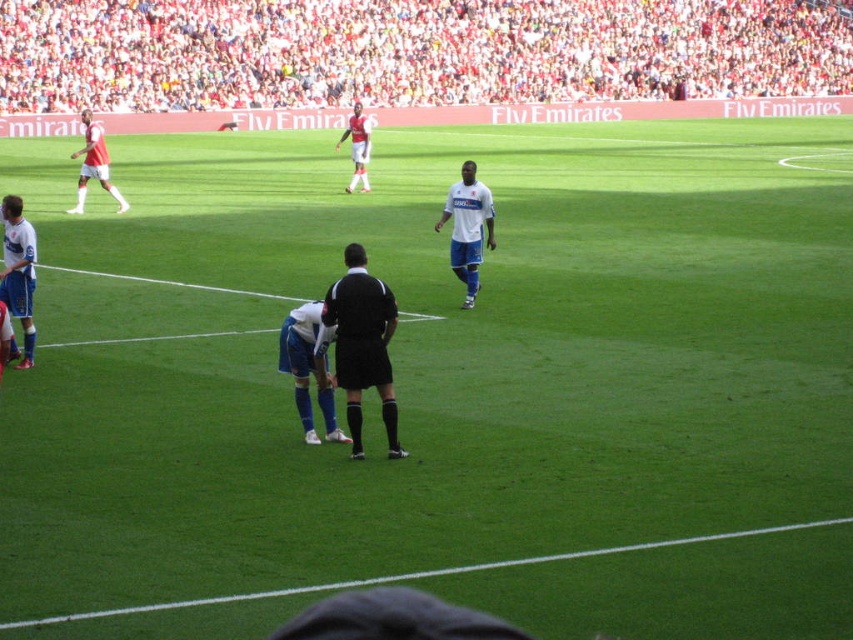
Is white matte soccer player at center to the left of white jersey at left from the viewer's perspective?

In fact, white matte soccer player at center is to the right of white jersey at left.

Does white matte soccer player at center appear over white jersey at left?

Correct, white matte soccer player at center is located above white jersey at left.

This screenshot has width=853, height=640. What do you see at coordinates (468, 227) in the screenshot?
I see `white matte soccer player at center` at bounding box center [468, 227].

Find the location of a particular element. This screenshot has width=853, height=640. white matte soccer player at center is located at coordinates (468, 227).

Is black matte referee at center below matte white shorts at left?

Indeed, black matte referee at center is positioned under matte white shorts at left.

In the scene shown: Between black matte referee at center and matte white shorts at left, which one has more height?

Standing taller between the two is matte white shorts at left.

Who is more forward, (345, 291) or (80, 154)?

Positioned in front is point (345, 291).

This screenshot has height=640, width=853. In order to click on black matte referee at center in this screenshot , I will do `click(363, 344)`.

In the scene shown: Is white fabric crowd at upper center below white matte soccer player at center?

No, white fabric crowd at upper center is not below white matte soccer player at center.

Which is below, white fabric crowd at upper center or white matte soccer player at center?

white matte soccer player at center

The image size is (853, 640). Describe the element at coordinates (412, 51) in the screenshot. I see `white fabric crowd at upper center` at that location.

Where is `white fabric crowd at upper center`? The width and height of the screenshot is (853, 640). white fabric crowd at upper center is located at coordinates (412, 51).